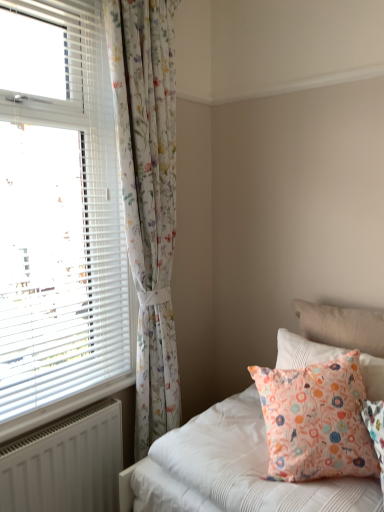
Question: Is white plastic blinds at left wider than floral fabric pillow at upper right, which is counted as the 2th pillow, starting from the front?

Choices:
 (A) no
 (B) yes

Answer: (A)

Question: Is white plastic blinds at left positioned in front of floral fabric pillow at upper right, which is counted as the 2th pillow, starting from the front?

Choices:
 (A) no
 (B) yes

Answer: (B)

Question: Is white plastic blinds at left facing away from floral fabric pillow at upper right, which is counted as the 2th pillow, starting from the front?

Choices:
 (A) no
 (B) yes

Answer: (A)

Question: Does white plastic blinds at left appear on the right side of floral fabric pillow at upper right, which is counted as the 2th pillow, starting from the front?

Choices:
 (A) no
 (B) yes

Answer: (A)

Question: Is white plastic blinds at left located outside floral fabric pillow at upper right, which is counted as the 2th pillow, starting from the front?

Choices:
 (A) yes
 (B) no

Answer: (A)

Question: In terms of height, does peach fabric pillow at lower right, the first pillow from the front, look taller or shorter compared to white plastic blinds at left?

Choices:
 (A) tall
 (B) short

Answer: (B)

Question: Does point tap(259, 381) appear closer or farther from the camera than point tap(96, 320)?

Choices:
 (A) closer
 (B) farther

Answer: (A)

Question: Looking at the image, does peach fabric pillow at lower right, the first pillow from the front, seem bigger or smaller compared to white plastic blinds at left?

Choices:
 (A) small
 (B) big

Answer: (A)

Question: Would you say peach fabric pillow at lower right, the first pillow from the front, is inside or outside white plastic blinds at left?

Choices:
 (A) inside
 (B) outside

Answer: (B)

Question: Is white plastic radiator at lower left in front of or behind white plastic blinds at left in the image?

Choices:
 (A) behind
 (B) front

Answer: (A)

Question: Choose the correct answer: Is white plastic radiator at lower left inside white plastic blinds at left or outside it?

Choices:
 (A) outside
 (B) inside

Answer: (A)

Question: Considering the positions of white plastic radiator at lower left and white plastic blinds at left in the image, is white plastic radiator at lower left bigger or smaller than white plastic blinds at left?

Choices:
 (A) big
 (B) small

Answer: (B)

Question: From the image's perspective, relative to white plastic blinds at left, is white plastic radiator at lower left above or below?

Choices:
 (A) below
 (B) above

Answer: (A)

Question: Is point (x=292, y=367) positioned closer to the camera than point (x=16, y=421)?

Choices:
 (A) farther
 (B) closer

Answer: (A)

Question: Considering the relative positions of floral fabric pillow at upper right, which is counted as the 2th pillow, starting from the front, and white plastic radiator at lower left in the image provided, is floral fabric pillow at upper right, which is counted as the 2th pillow, starting from the front, to the left or to the right of white plastic radiator at lower left?

Choices:
 (A) right
 (B) left

Answer: (A)